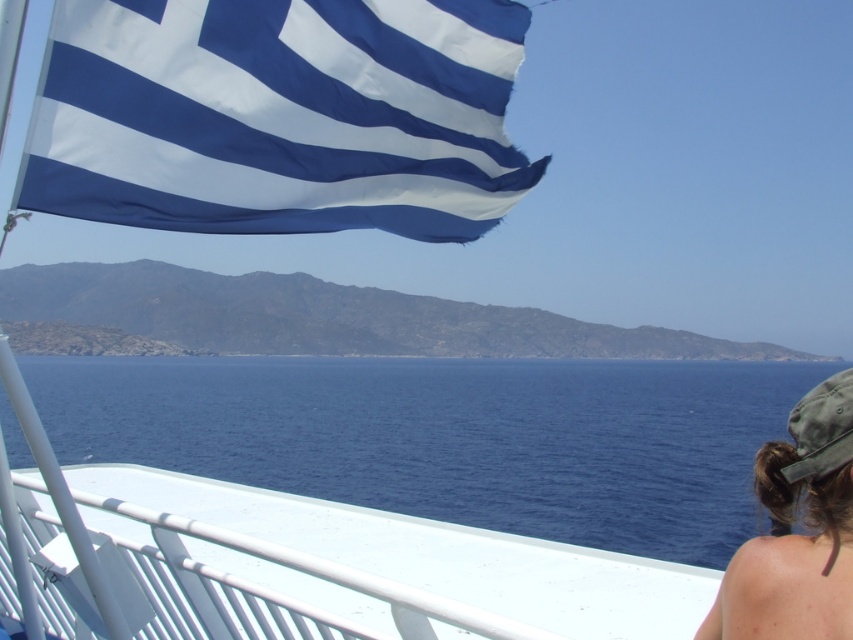
Question: Which of these objects is positioned farthest from the blue fabric flag at upper left?

Choices:
 (A) brown hair at lower right
 (B) blue water at lower center

Answer: (B)

Question: Which object appears farthest from the camera in this image?

Choices:
 (A) brown hair at lower right
 (B) blue water at lower center

Answer: (B)

Question: Which point is closer to the camera?

Choices:
 (A) click(x=479, y=109)
 (B) click(x=732, y=592)
 (C) click(x=708, y=509)

Answer: (B)

Question: Is blue water at lower center below brown hair at lower right?

Choices:
 (A) no
 (B) yes

Answer: (B)

Question: Does blue water at lower center come behind blue fabric flag at upper left?

Choices:
 (A) no
 (B) yes

Answer: (A)

Question: Considering the relative positions of blue water at lower center and brown hair at lower right in the image provided, where is blue water at lower center located with respect to brown hair at lower right?

Choices:
 (A) left
 (B) right

Answer: (B)